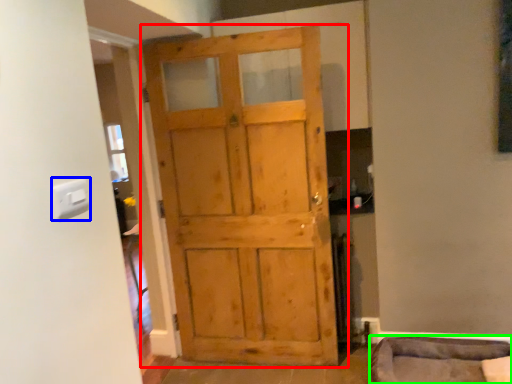
Question: Which is nearer to the door (highlighted by a red box)? light switch (highlighted by a blue box) or furniture (highlighted by a green box).

Choices:
 (A) light switch
 (B) furniture

Answer: (B)